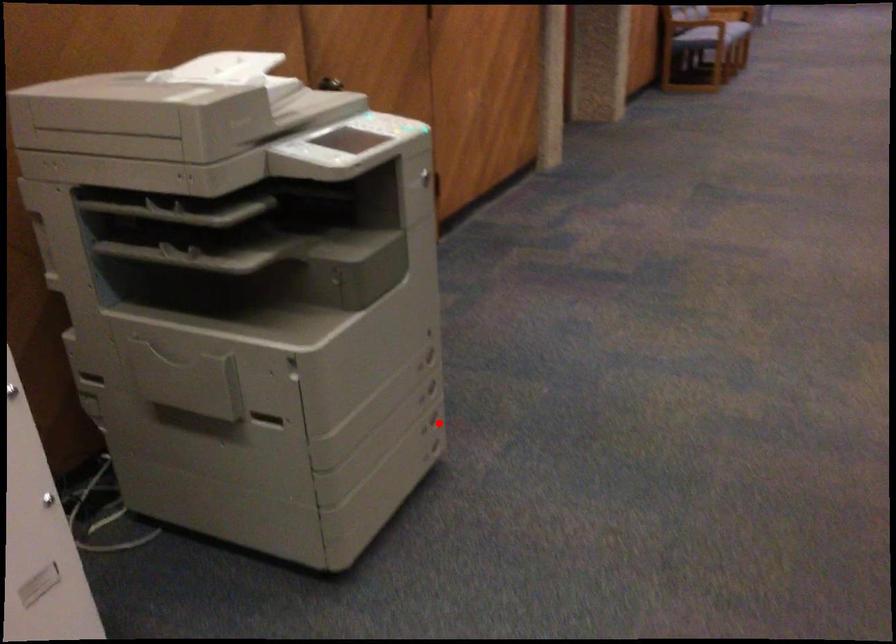
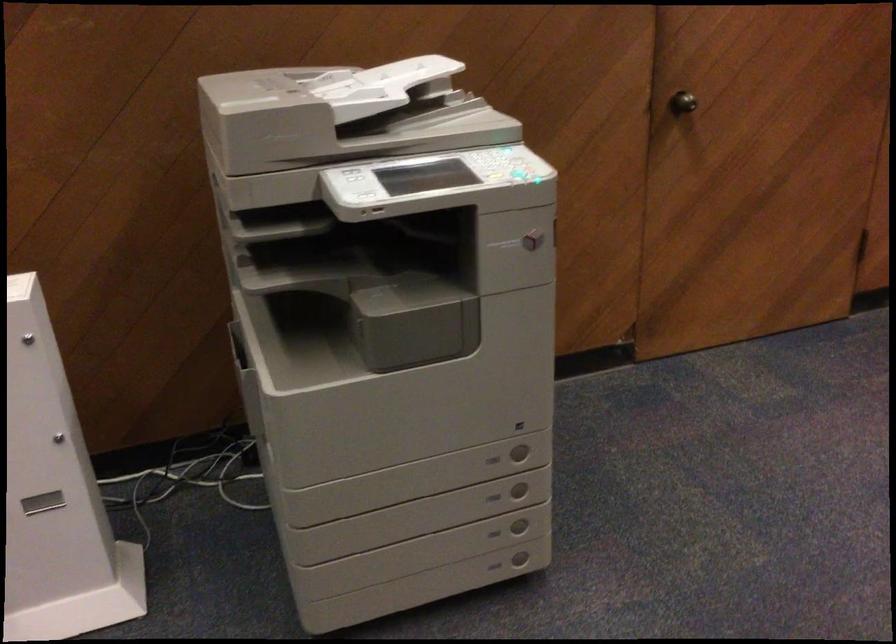
Find the pixel in the second image that matches the highlighted location in the first image.

(519, 527)